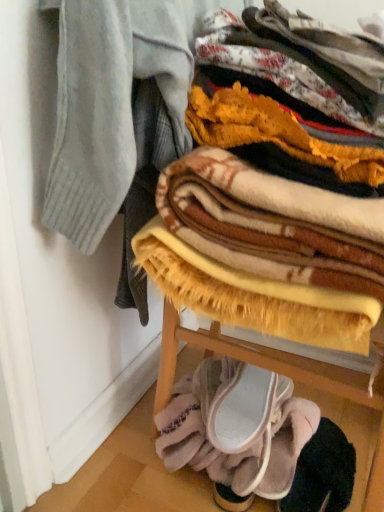
Question: Does pink suede sneakers at lower center, placed as the 1th footwear when sorted from bottom to top, have a greater height compared to soft yellow blanket at lower center, the second blanket when ordered from top to bottom?

Choices:
 (A) no
 (B) yes

Answer: (A)

Question: Can you confirm if pink suede sneakers at lower center, the second footwear from the top, is smaller than soft yellow blanket at lower center, the second blanket when ordered from top to bottom?

Choices:
 (A) yes
 (B) no

Answer: (A)

Question: From a real-world perspective, is pink suede sneakers at lower center, the second footwear from the top, physically above soft yellow blanket at lower center, acting as the 1th blanket starting from the bottom?

Choices:
 (A) yes
 (B) no

Answer: (A)

Question: Is soft yellow blanket at lower center, the second blanket when ordered from top to bottom, at the back of pink suede sneakers at lower center, placed as the 1th footwear when sorted from bottom to top?

Choices:
 (A) yes
 (B) no

Answer: (B)

Question: Considering the relative sizes of pink suede sneakers at lower center, placed as the 1th footwear when sorted from bottom to top, and soft yellow blanket at lower center, acting as the 1th blanket starting from the bottom, in the image provided, is pink suede sneakers at lower center, placed as the 1th footwear when sorted from bottom to top, bigger than soft yellow blanket at lower center, acting as the 1th blanket starting from the bottom,?

Choices:
 (A) yes
 (B) no

Answer: (B)

Question: From the image's perspective, is pink suede sneakers at lower center, the second footwear from the top, above or below soft yellow blanket at lower center, acting as the 1th blanket starting from the bottom?

Choices:
 (A) above
 (B) below

Answer: (B)

Question: In the image, is pink suede sneakers at lower center, placed as the 1th footwear when sorted from bottom to top, positioned in front of or behind soft yellow blanket at lower center, the second blanket when ordered from top to bottom?

Choices:
 (A) behind
 (B) front

Answer: (B)

Question: From a real-world perspective, is pink suede sneakers at lower center, the second footwear from the top, above or below soft yellow blanket at lower center, acting as the 1th blanket starting from the bottom?

Choices:
 (A) above
 (B) below

Answer: (A)

Question: Does point (274, 473) appear closer or farther from the camera than point (253, 368)?

Choices:
 (A) closer
 (B) farther

Answer: (A)

Question: Is point (208, 422) closer or farther from the camera than point (357, 266)?

Choices:
 (A) farther
 (B) closer

Answer: (A)

Question: From a real-world perspective, is pink suede slipper at lower center, which appears as the 1th footwear when viewed from the top, physically located above or below plush yellow blanket at center, acting as the first blanket starting from the top?

Choices:
 (A) below
 (B) above

Answer: (A)

Question: Is pink suede slipper at lower center, placed as the 2th footwear when sorted from bottom to top, in front of or behind plush yellow blanket at center, acting as the first blanket starting from the top, in the image?

Choices:
 (A) behind
 (B) front

Answer: (A)

Question: From their relative heights in the image, would you say pink suede slipper at lower center, which appears as the 1th footwear when viewed from the top, is taller or shorter than plush yellow blanket at center, the 2th blanket ordered from the bottom?

Choices:
 (A) short
 (B) tall

Answer: (A)

Question: Looking at the image, does plush yellow blanket at center, the 2th blanket ordered from the bottom, seem bigger or smaller compared to pink suede slipper at lower center, placed as the 2th footwear when sorted from bottom to top?

Choices:
 (A) small
 (B) big

Answer: (B)

Question: Relative to pink suede slipper at lower center, placed as the 2th footwear when sorted from bottom to top, is plush yellow blanket at center, the 2th blanket ordered from the bottom, in front or behind?

Choices:
 (A) front
 (B) behind

Answer: (A)